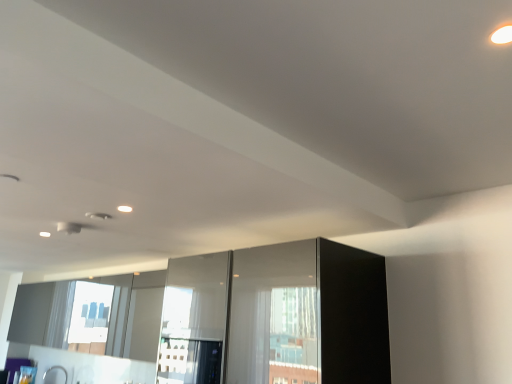
Question: Can you confirm if satin nickel faucet at lower left is positioned to the left of transparent glass screen door at center, acting as the first screen door starting from the left?

Choices:
 (A) no
 (B) yes

Answer: (B)

Question: Is satin nickel faucet at lower left oriented away from transparent glass screen door at center, which ranks as the second screen door in right-to-left order?

Choices:
 (A) yes
 (B) no

Answer: (B)

Question: Considering the relative sizes of satin nickel faucet at lower left and transparent glass screen door at center, which ranks as the second screen door in right-to-left order, in the image provided, is satin nickel faucet at lower left bigger than transparent glass screen door at center, which ranks as the second screen door in right-to-left order,?

Choices:
 (A) yes
 (B) no

Answer: (B)

Question: Does satin nickel faucet at lower left come in front of transparent glass screen door at center, which ranks as the second screen door in right-to-left order?

Choices:
 (A) no
 (B) yes

Answer: (A)

Question: Is satin nickel faucet at lower left smaller than transparent glass screen door at center, which ranks as the second screen door in right-to-left order?

Choices:
 (A) no
 (B) yes

Answer: (B)

Question: Does satin nickel faucet at lower left come behind transparent glass screen door at center, which ranks as the second screen door in right-to-left order?

Choices:
 (A) yes
 (B) no

Answer: (A)

Question: From a real-world perspective, is transparent glass screen door at center, which ranks as the second screen door in right-to-left order, positioned under satin nickel faucet at lower left based on gravity?

Choices:
 (A) no
 (B) yes

Answer: (A)

Question: Would you say satin nickel faucet at lower left is part of transparent glass screen door at center, which ranks as the second screen door in right-to-left order,'s contents?

Choices:
 (A) yes
 (B) no

Answer: (B)

Question: Is transparent glass screen door at center, which ranks as the second screen door in right-to-left order, facing away from satin nickel faucet at lower left?

Choices:
 (A) no
 (B) yes

Answer: (A)

Question: Does transparent glass screen door at center, acting as the first screen door starting from the left, appear on the left side of satin nickel faucet at lower left?

Choices:
 (A) yes
 (B) no

Answer: (B)

Question: From the image's perspective, is transparent glass screen door at center, acting as the first screen door starting from the left, located beneath satin nickel faucet at lower left?

Choices:
 (A) no
 (B) yes

Answer: (A)

Question: Are transparent glass screen door at center, which ranks as the second screen door in right-to-left order, and satin nickel faucet at lower left beside each other?

Choices:
 (A) no
 (B) yes

Answer: (A)

Question: Could you tell me if transparent glass screen door at center, which ranks as the second screen door in right-to-left order, is facing glossy glass screen door at center, the 1th screen door positioned from the right?

Choices:
 (A) no
 (B) yes

Answer: (A)